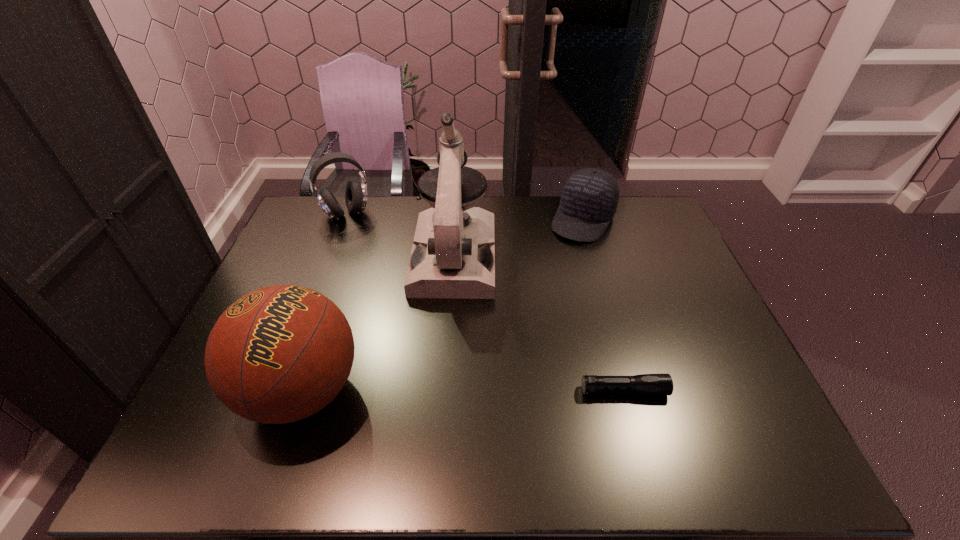
Locate an element on the screen. This screenshot has width=960, height=540. object that is the fourth nearest to the flashlight is located at coordinates (356, 193).

Where is `vacant space that satisfies the following two spatial constraints: 1. on the front side of the flashlight; 2. at the lens end of the microscope`? The width and height of the screenshot is (960, 540). vacant space that satisfies the following two spatial constraints: 1. on the front side of the flashlight; 2. at the lens end of the microscope is located at coordinates (445, 390).

Locate an element on the screen. Image resolution: width=960 pixels, height=540 pixels. free spot that satisfies the following two spatial constraints: 1. on the front side of the third object from right to left; 2. at the lens end of the shortest object is located at coordinates (445, 390).